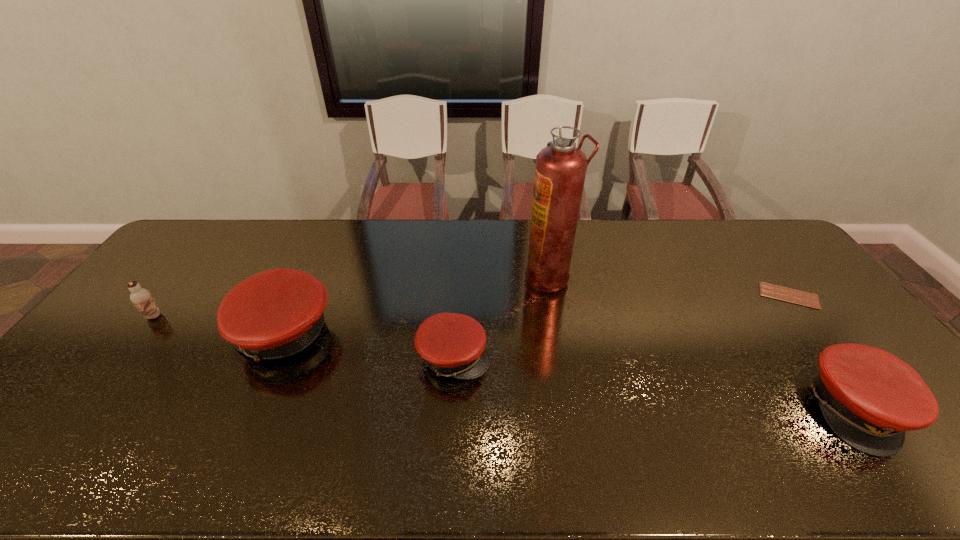
At what (x,y) coordinates should I click in order to perform the action: click on object present at the left edge. Please return your answer as a coordinate pair (x, y). This screenshot has width=960, height=540. Looking at the image, I should click on tap(141, 298).

You are a GUI agent. You are given a task and a screenshot of the screen. Output one action in this format:
    pyautogui.click(x=<x>, y=<y>)
    Task: Click on the cap that is at the right edge
    
    Given the screenshot: What is the action you would take?
    pyautogui.click(x=869, y=397)

You are a GUI agent. You are given a task and a screenshot of the screen. Output one action in this format:
    pyautogui.click(x=<x>, y=<y>)
    Task: Click on the chocolate bar that is at the right edge
    The width and height of the screenshot is (960, 540).
    Given the screenshot: What is the action you would take?
    pyautogui.click(x=794, y=296)

Where is `object that is at the near right corner`? Image resolution: width=960 pixels, height=540 pixels. object that is at the near right corner is located at coordinates click(869, 397).

You are a GUI agent. You are given a task and a screenshot of the screen. Output one action in this format:
    pyautogui.click(x=<x>, y=<y>)
    Task: Click on the free location at the far edge
    The image size is (960, 540).
    Given the screenshot: What is the action you would take?
    pyautogui.click(x=470, y=255)

Where is `vacant space at the near edge of the desktop`? This screenshot has width=960, height=540. vacant space at the near edge of the desktop is located at coordinates (341, 417).

In the image, there is a desktop. Where is `free space at the left edge`? Image resolution: width=960 pixels, height=540 pixels. free space at the left edge is located at coordinates (115, 320).

The width and height of the screenshot is (960, 540). In order to click on free space between the leftmost object and the second object from left to right in this screenshot , I will do `click(218, 325)`.

Find the location of a particular element. Image resolution: width=960 pixels, height=540 pixels. free point between the leftmost object and the fire extinguisher is located at coordinates (351, 296).

Where is `free space that is in between the fourth tallest object and the chocolate milk`? free space that is in between the fourth tallest object and the chocolate milk is located at coordinates (505, 362).